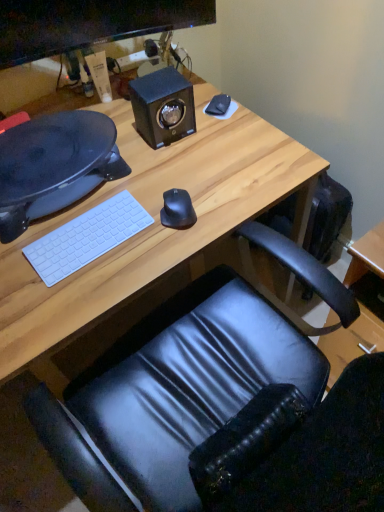
Question: From the image's perspective, is matte black monitor at upper left located above or below black textured speaker at upper center?

Choices:
 (A) below
 (B) above

Answer: (B)

Question: Is point (48, 53) closer or farther from the camera than point (155, 82)?

Choices:
 (A) farther
 (B) closer

Answer: (A)

Question: Which object is positioned farthest from the black glossy speaker at left?

Choices:
 (A) black matte notepad at upper right
 (B) wooden desk at center
 (C) matte black monitor at upper left
 (D) black matte mouse at center
 (E) black textured speaker at upper center

Answer: (A)

Question: Estimate the real-world distances between objects in this image. Which object is farther from the black glossy speaker at left?

Choices:
 (A) matte black monitor at upper left
 (B) black matte notepad at upper right
 (C) wooden desk at center
 (D) white matte keyboard at lower left
 (E) black matte mouse at center

Answer: (B)